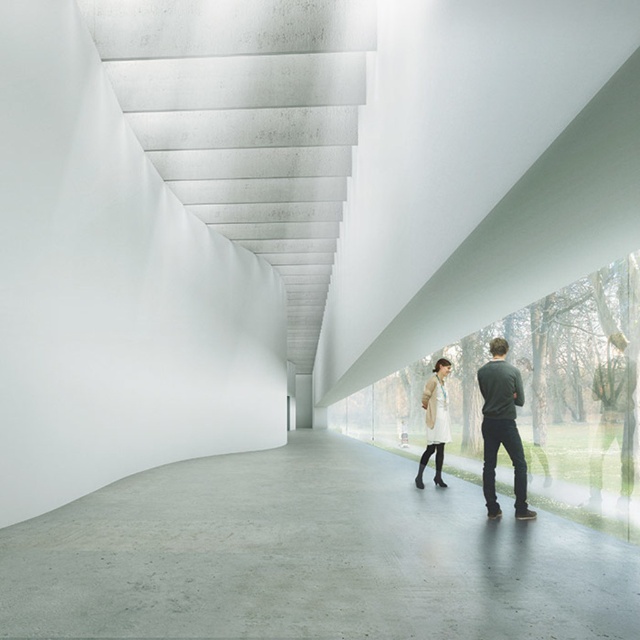
Does gray polished concrete floor at center appear over light beige sweater at center?

No.

Consider the image. Is the position of gray polished concrete floor at center less distant than that of light beige sweater at center?

Yes, it is in front of light beige sweater at center.

The image size is (640, 640). What do you see at coordinates (308, 557) in the screenshot?
I see `gray polished concrete floor at center` at bounding box center [308, 557].

You are a GUI agent. You are given a task and a screenshot of the screen. Output one action in this format:
    pyautogui.click(x=<x>, y=<y>)
    Task: Click on the gray polished concrete floor at center
    The height and width of the screenshot is (640, 640).
    Given the screenshot: What is the action you would take?
    pyautogui.click(x=308, y=557)

Between light beige sweater at center and dark green sweater at center, which one is positioned lower?

light beige sweater at center is lower down.

Does light beige sweater at center appear under dark green sweater at center?

Yes.

Who is more forward, (492, 404) or (508, 372)?

Point (508, 372)

Where is `light beige sweater at center`? light beige sweater at center is located at coordinates (500, 428).

Between light beige sweater at center and beige wool coat at center, which one is positioned lower?

beige wool coat at center is lower down.

Who is more distant from viewer, (492, 508) or (435, 401)?

The point (435, 401) is behind.

Find the location of a particular element. Image resolution: width=640 pixels, height=640 pixels. light beige sweater at center is located at coordinates (500, 428).